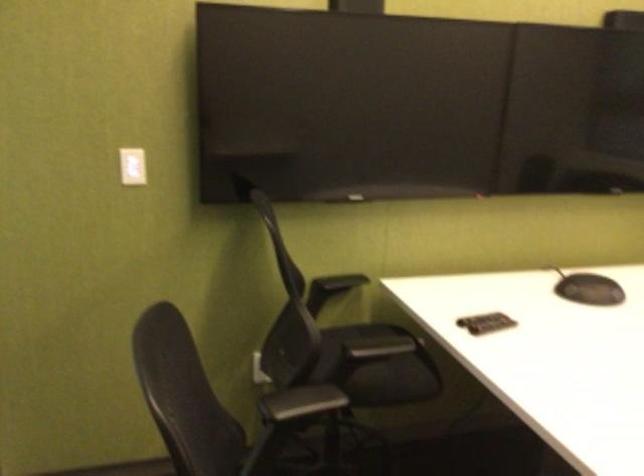
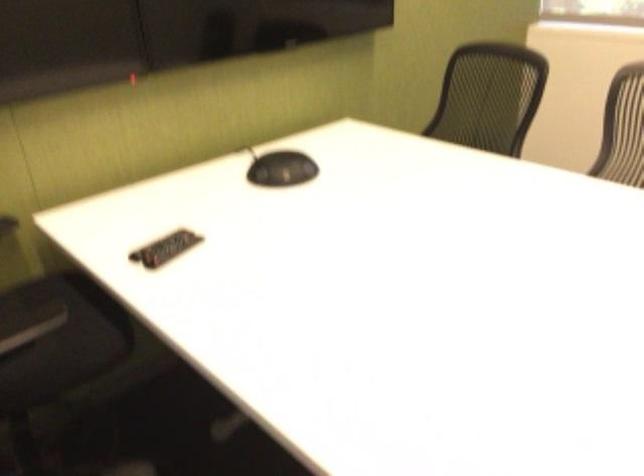
Find the pixel in the second image that matches point (491, 324) in the first image.

(165, 248)